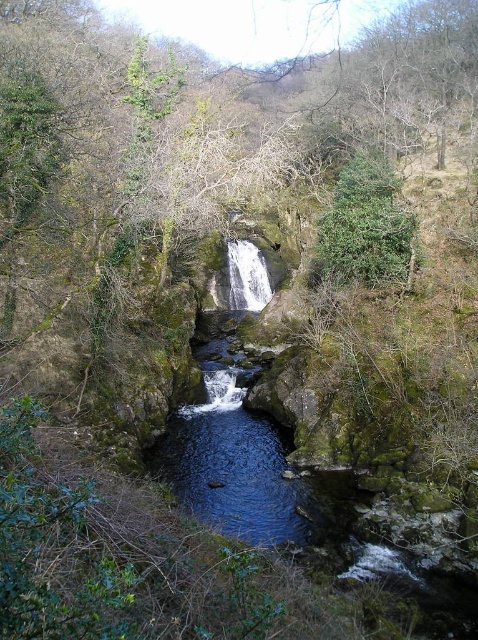
You are standing at the base of the waterfall and want to reach the two points marked in the image. Which point, point (x=150, y=465) or point (x=239, y=260), is closer to you?

Point (x=150, y=465) is closer to you because it is in front of point (x=239, y=260).

In the scene shown: You are standing at the edge of the pool below the waterfall and want to place a small statue on the closest object to you between the dark blue rock at center and the white textured waterfall at center. Which object should you choose?

The dark blue rock at center is closer to the viewer than the white textured waterfall at center, so you should place the statue on the dark blue rock at center.

You are standing in the natural scene and want to take a photo of the green leafy tree at upper center and the white textured waterfall at center. Which object should you focus on first to ensure both are in focus?

You should focus on the green leafy tree at upper center first because it is closer to you than the white textured waterfall at center, so adjusting focus from near to far will help both be in focus.